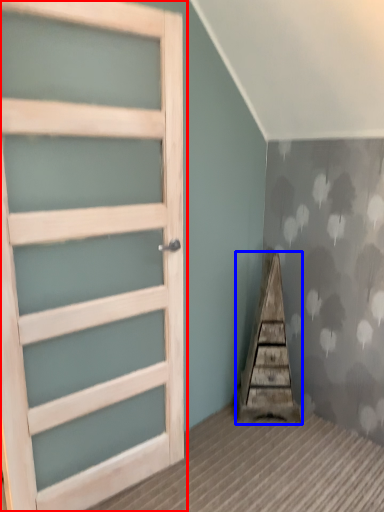
Question: Which point is further to the camera, door (highlighted by a red box) or stairwell (highlighted by a blue box)?

Choices:
 (A) door
 (B) stairwell

Answer: (B)